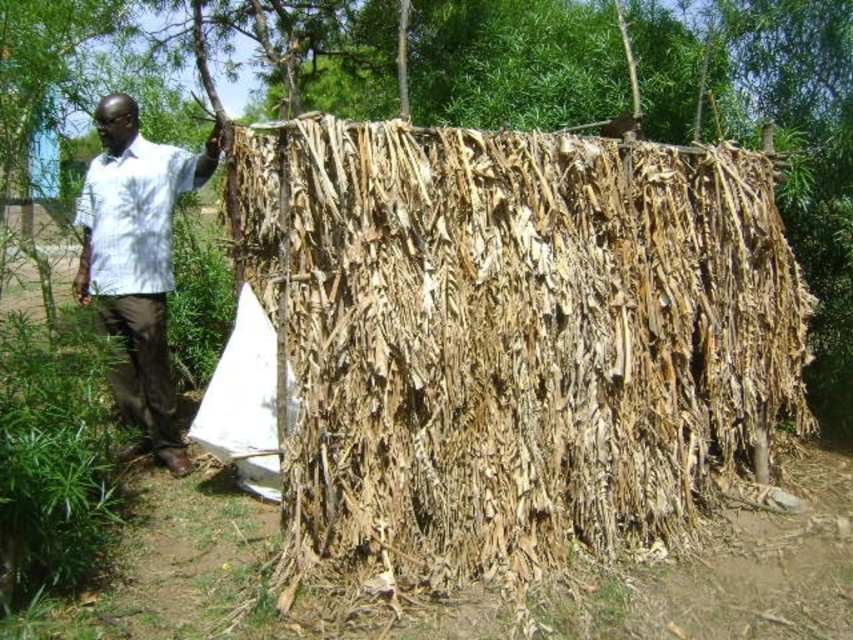
Who is taller, brown dried leaves at center or white shirt at left?

white shirt at left

Which is more to the right, brown dried leaves at center or white shirt at left?

brown dried leaves at center

Describe the element at coordinates (514, 339) in the screenshot. I see `brown dried leaves at center` at that location.

In order to click on brown dried leaves at center in this screenshot , I will do `click(514, 339)`.

Is white shirt at left shorter than white textured shirt at left?

No, white shirt at left is not shorter than white textured shirt at left.

Does point (84, 262) lie behind point (128, 246)?

Yes.

Does point (158, 426) lie in front of point (120, 224)?

No, (158, 426) is behind (120, 224).

Locate an element on the screen. The width and height of the screenshot is (853, 640). white shirt at left is located at coordinates (137, 259).

Does brown dried leaves at center appear over white textured shirt at left?

No, brown dried leaves at center is not above white textured shirt at left.

Image resolution: width=853 pixels, height=640 pixels. What do you see at coordinates (514, 339) in the screenshot?
I see `brown dried leaves at center` at bounding box center [514, 339].

Find the location of a particular element. This screenshot has width=853, height=640. brown dried leaves at center is located at coordinates (514, 339).